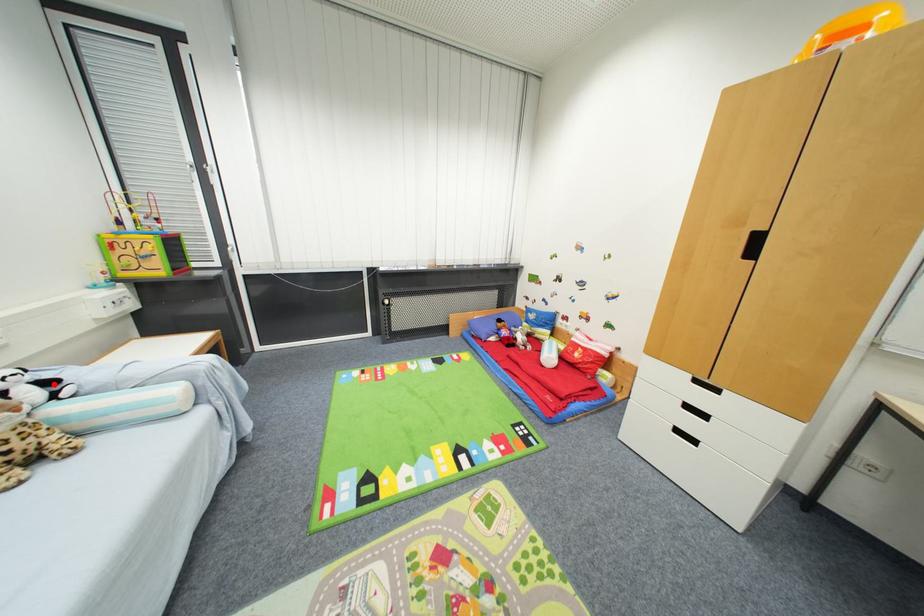
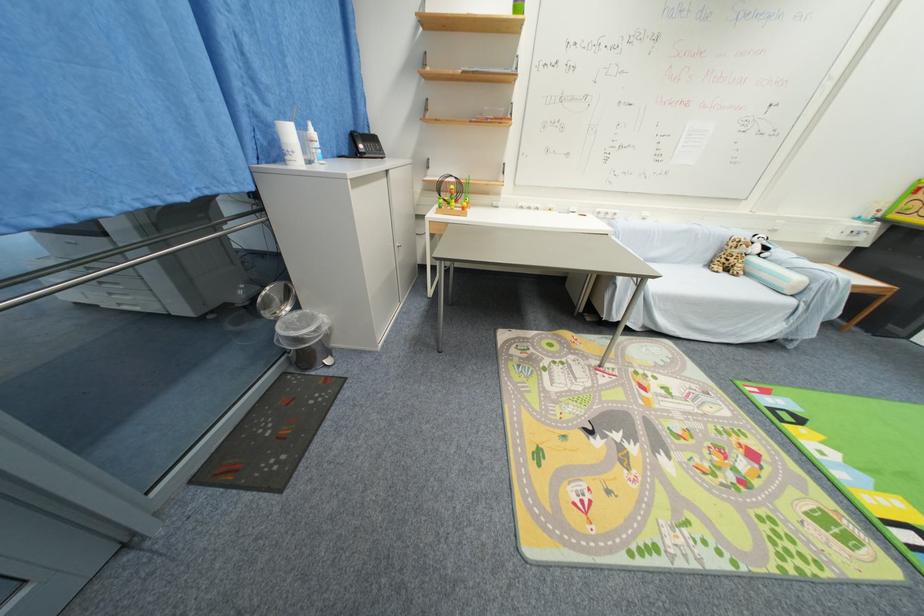
In the second image, find the point that corresponds to the highlighted location in the first image.

(771, 249)